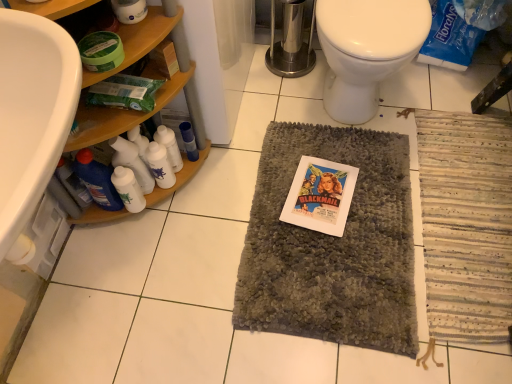
Where is `vacant area on the back side of matte paper comic book at center`? This screenshot has height=384, width=512. vacant area on the back side of matte paper comic book at center is located at coordinates (315, 145).